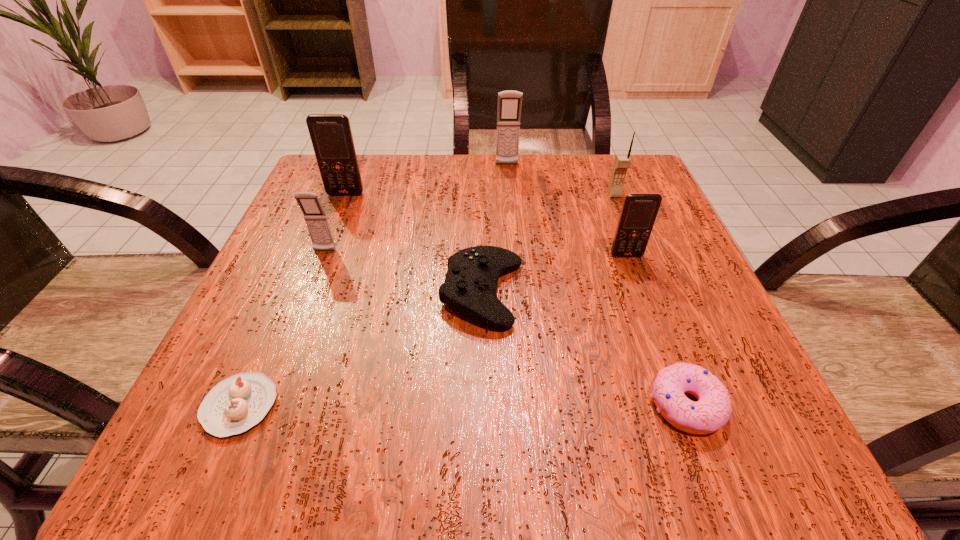
At what (x,y) coordinates should I click in order to perform the action: click on the right gray cellular telephone. Please return your answer as a coordinate pair (x, y). The height and width of the screenshot is (540, 960). Looking at the image, I should click on (509, 102).

Where is `the farthest cellular telephone`? The width and height of the screenshot is (960, 540). the farthest cellular telephone is located at coordinates (509, 102).

Identify the location of the bigger orange cellular telephone. (331, 135).

At what (x,y) coordinates should I click in order to perform the action: click on the farther orange cellular telephone. Please return your answer as a coordinate pair (x, y). Looking at the image, I should click on (331, 135).

This screenshot has height=540, width=960. Find the location of `the smaller orange cellular telephone`. the smaller orange cellular telephone is located at coordinates (639, 211).

This screenshot has width=960, height=540. Identify the location of the right orange cellular telephone. point(639,211).

At what (x,y) coordinates should I click in order to perform the action: click on the smaller gray cellular telephone. Please return your answer as a coordinate pair (x, y). The width and height of the screenshot is (960, 540). Looking at the image, I should click on (316, 220).

Image resolution: width=960 pixels, height=540 pixels. I want to click on the left gray cellular telephone, so click(316, 220).

You are a GUI agent. You are given a task and a screenshot of the screen. Output one action in this format:
    pyautogui.click(x=<x>, y=<y>)
    Task: Click on the control
    The image size is (960, 540).
    Given the screenshot: What is the action you would take?
    pyautogui.click(x=470, y=285)

The image size is (960, 540). Find the location of `the sixth farthest object`. the sixth farthest object is located at coordinates (470, 285).